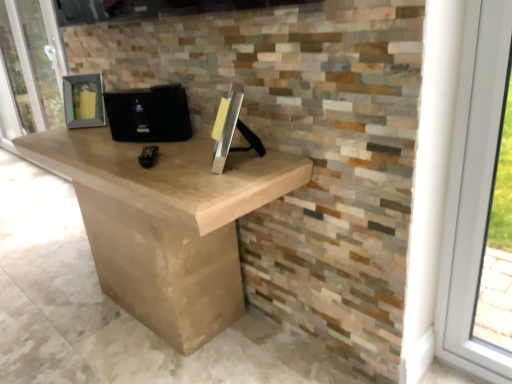
The height and width of the screenshot is (384, 512). In order to click on black matte speaker at center in this screenshot , I will do `click(149, 114)`.

Describe the element at coordinates (149, 114) in the screenshot. I see `black matte speaker at center` at that location.

Image resolution: width=512 pixels, height=384 pixels. Find the location of `matte gray frame at left`. matte gray frame at left is located at coordinates (31, 66).

Describe the element at coordinates (31, 66) in the screenshot. I see `matte gray frame at left` at that location.

Identify the location of black matte speaker at center. The width and height of the screenshot is (512, 384). (149, 114).

Does matte gray frame at left appear on the left side of black matte speaker at center?

Yes, matte gray frame at left is to the left of black matte speaker at center.

Does matte gray frame at left come in front of black matte speaker at center?

No, it is behind black matte speaker at center.

Does point (37, 111) come farther from viewer compared to point (181, 97)?

That is True.

From the image's perspective, which is above, matte gray frame at left or black matte speaker at center?

matte gray frame at left appears higher in the image.

From a real-world perspective, between matte gray frame at left and black matte speaker at center, who is vertically higher?

In real-world perspective, black matte speaker at center is above.

Considering the relative sizes of matte gray frame at left and black matte speaker at center in the image provided, is matte gray frame at left thinner than black matte speaker at center?

Yes.

Does matte gray frame at left have a lesser height compared to black matte speaker at center?

No.

Can you confirm if matte gray frame at left is smaller than black matte speaker at center?

No, matte gray frame at left is not smaller than black matte speaker at center.

Choose the correct answer: Is matte gray frame at left inside black matte speaker at center or outside it?

A: matte gray frame at left lies outside black matte speaker at center.

Are matte gray frame at left and black matte speaker at center far apart?

Yes, matte gray frame at left is far from black matte speaker at center.

Is matte gray frame at left oriented away from black matte speaker at center?

No, matte gray frame at left's orientation is not away from black matte speaker at center.

How many degrees apart are the facing directions of matte gray frame at left and black matte speaker at center?

matte gray frame at left and black matte speaker at center are facing 32.9 degrees away from each other.

What are the coordinates of `computer below the matte gray frame at left (from the image's perspective)` in the screenshot? It's located at (149, 114).

Between black matte speaker at center and matte gray frame at left, which one appears on the right side from the viewer's perspective?

Positioned to the right is black matte speaker at center.

Is black matte speaker at center positioned before matte gray frame at left?

Yes, the depth of black matte speaker at center is less than that of matte gray frame at left.

Is point (140, 95) less distant than point (11, 89)?

Yes, it is.

From the image's perspective, is black matte speaker at center over matte gray frame at left?

Incorrect, from the image's perspective, black matte speaker at center is lower than matte gray frame at left.

From a real-world perspective, which object stands above the other?

From a 3D spatial view, black matte speaker at center is above.

Looking at their sizes, would you say black matte speaker at center is wider or thinner than matte gray frame at left?

black matte speaker at center is wider than matte gray frame at left.

In terms of height, does black matte speaker at center look taller or shorter compared to matte gray frame at left?

In the image, black matte speaker at center appears to be shorter than matte gray frame at left.

Considering the sizes of objects black matte speaker at center and matte gray frame at left in the image provided, who is bigger, black matte speaker at center or matte gray frame at left?

Bigger between the two is matte gray frame at left.

Do you think black matte speaker at center is within matte gray frame at left, or outside of it?

black matte speaker at center is located beyond the bounds of matte gray frame at left.

Is black matte speaker at center next to matte gray frame at left and touching it?

No, black matte speaker at center is not with matte gray frame at left.

Could you tell me if black matte speaker at center is facing matte gray frame at left?

No.

Consider the image. How many degrees apart are the facing directions of black matte speaker at center and matte gray frame at left?

The angle between the facing direction of black matte speaker at center and the facing direction of matte gray frame at left is 32.9 degrees.

The height and width of the screenshot is (384, 512). What are the coordinates of `screen door located underneath the black matte speaker at center (from a real-world perspective)` in the screenshot? It's located at (31, 66).

The image size is (512, 384). Identify the location of computer on the right of matte gray frame at left. (149, 114).

What are the coordinates of `screen door behind the black matte speaker at center` in the screenshot? It's located at (31, 66).